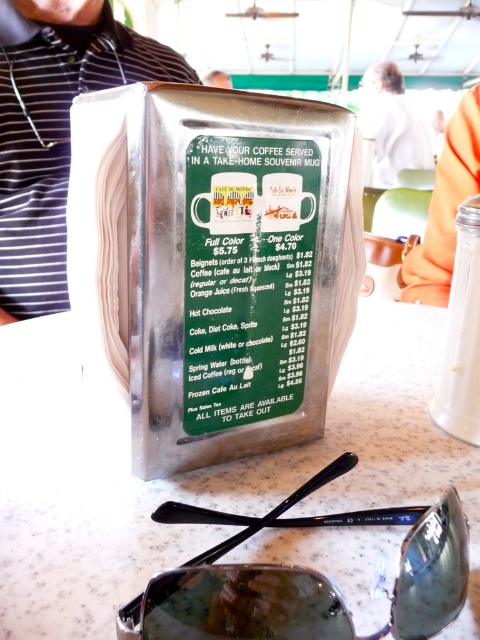
Who is more distant from viewer, (14, 275) or (434, 609)?

Positioned behind is point (14, 275).

Does point (25, 189) come closer to viewer compared to point (242, 618)?

That is False.

The width and height of the screenshot is (480, 640). In order to click on brushed metal menu at center in this screenshot , I will do `click(55, 131)`.

Is point (294, 456) positioned after point (45, 32)?

No, it is in front of (45, 32).

Is point (244, 465) closer to camera compared to point (28, 61)?

Yes, point (244, 465) is in front of point (28, 61).

Which is behind, point (14, 410) or point (6, 276)?

Positioned behind is point (6, 276).

You are a GUI agent. You are given a task and a screenshot of the screen. Output one action in this format:
    pyautogui.click(x=<x>, y=<y>)
    Task: Click on the white marble table at center
    The width and height of the screenshot is (480, 640).
    Given the screenshot: What is the action you would take?
    pyautogui.click(x=197, y=472)

Is metallic green menu at center to the left of brushed metal menu at center from the viewer's perspective?

In fact, metallic green menu at center is to the right of brushed metal menu at center.

Can you confirm if metallic green menu at center is smaller than brushed metal menu at center?

Correct, metallic green menu at center occupies less space than brushed metal menu at center.

Who is more distant from viewer, [275,253] or [55,294]?

The point [55,294] is behind.

Locate an element on the screen. metallic green menu at center is located at coordinates (247, 276).